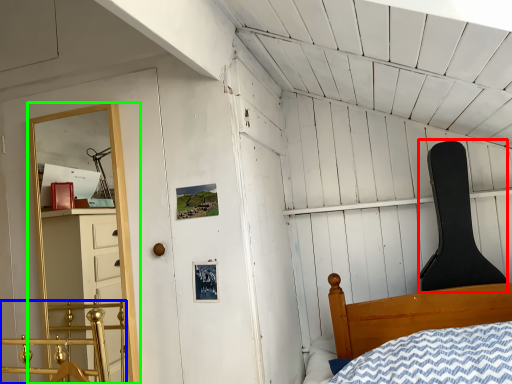
Question: Which object is positioned farthest from chair (highlighted by a red box)? Select from rail (highlighted by a blue box) and shelf (highlighted by a green box).

Choices:
 (A) rail
 (B) shelf

Answer: (A)